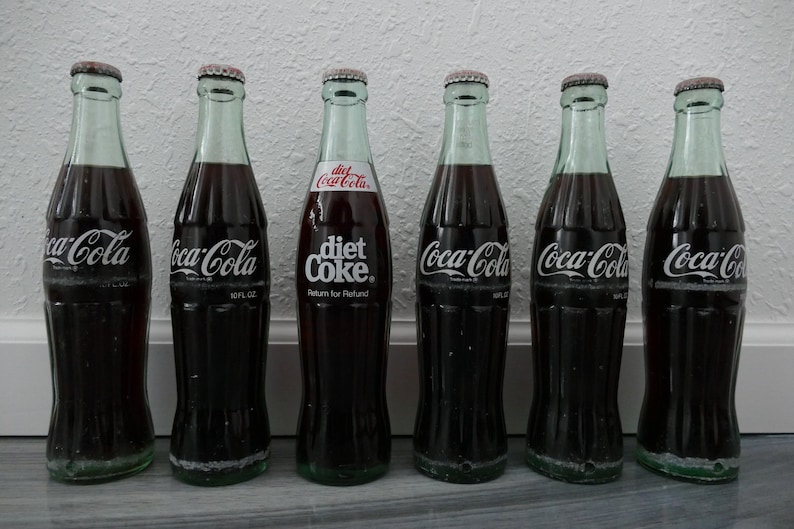
Identify the location of glass. (93, 131), (220, 144), (352, 132), (472, 141), (584, 143), (707, 147).